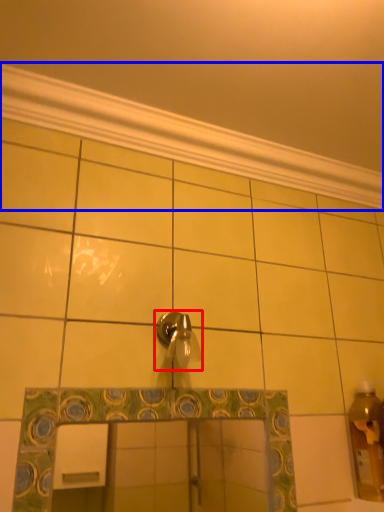
Question: Among these objects, which one is nearest to the camera, tap (highlighted by a red box) or molding (highlighted by a blue box)?

Choices:
 (A) tap
 (B) molding

Answer: (A)